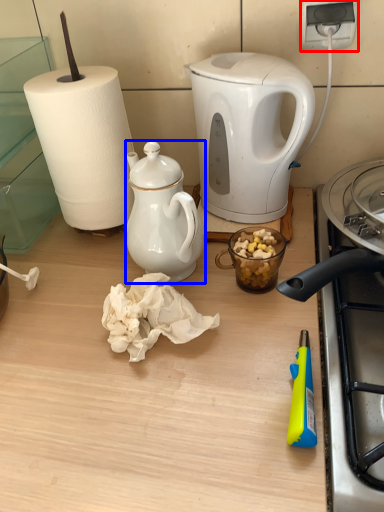
Question: Which object is closer to the camera taking this photo, power outlet (highlighted by a red box) or teapot (highlighted by a blue box)?

Choices:
 (A) power outlet
 (B) teapot

Answer: (B)